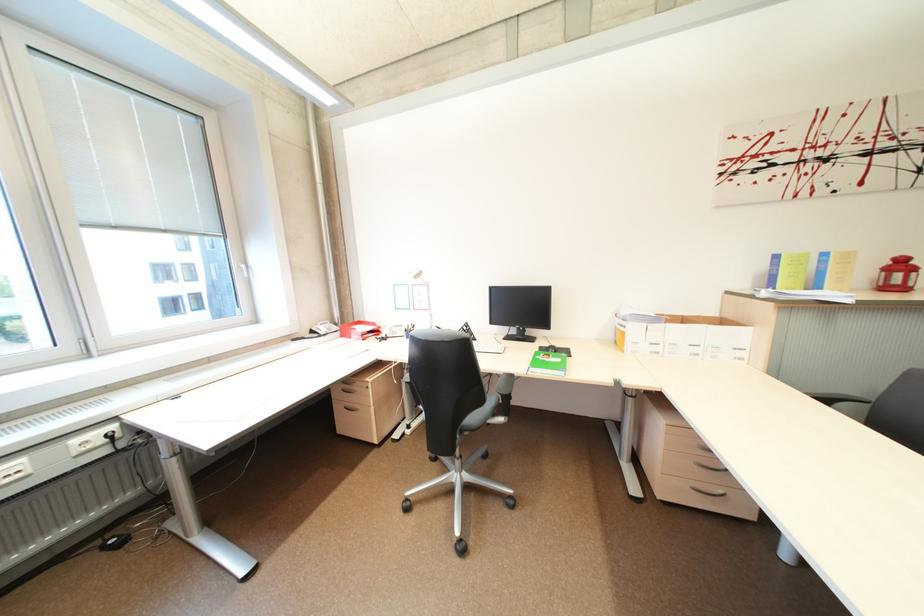
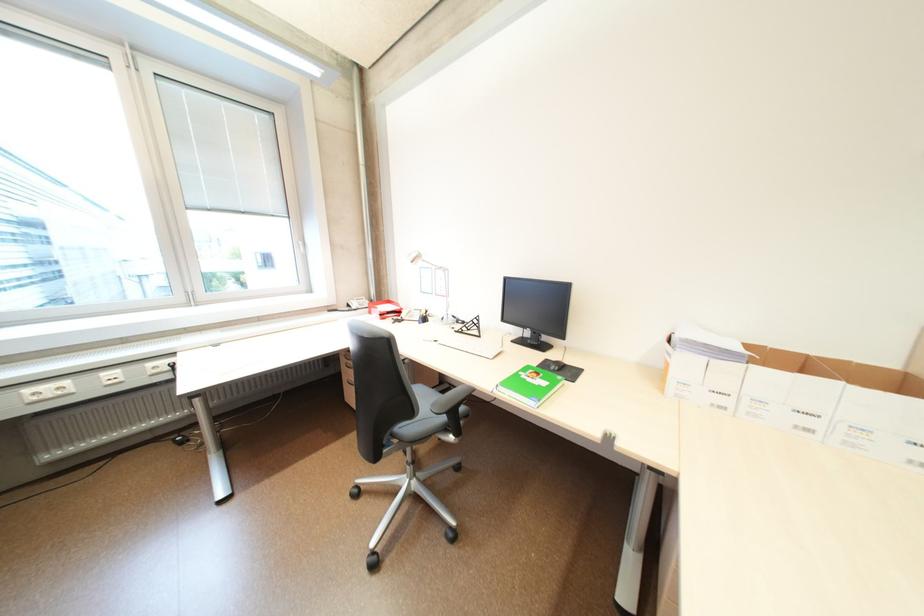
Question: The first image is from the beginning of the video and the second image is from the end. How did the camera likely rotate when shooting the video?

Choices:
 (A) Left
 (B) Right
 (C) Up
 (D) Down

Answer: (A)